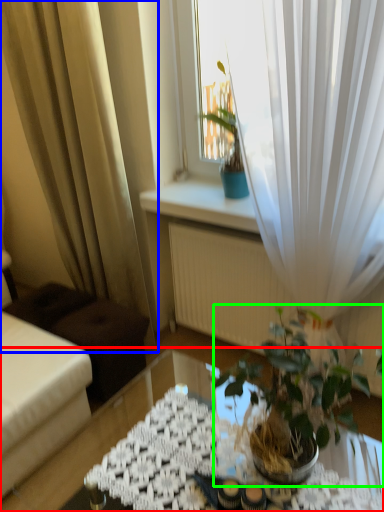
Question: Which object is the closest to the table (highlighted by a red box)? Choose among these: curtain (highlighted by a blue box) or houseplant (highlighted by a green box).

Choices:
 (A) curtain
 (B) houseplant

Answer: (B)